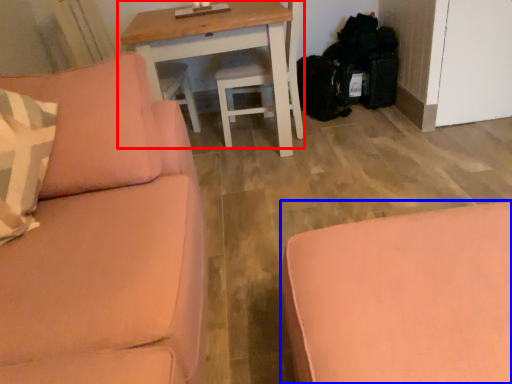
Question: Among these objects, which one is nearest to the camera, table (highlighted by a red box) or studio couch (highlighted by a blue box)?

Choices:
 (A) table
 (B) studio couch

Answer: (B)